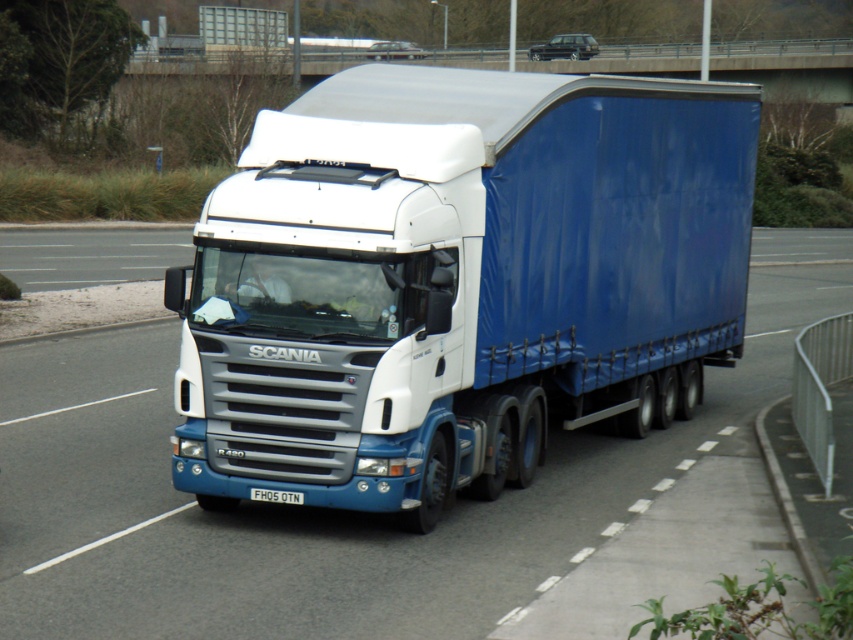
How much distance is there between white matte truck at center and blue fabric truck at center?

white matte truck at center is 3.17 meters away from blue fabric truck at center.

Does white matte truck at center appear over blue fabric truck at center?

No.

Is point (306, 156) more distant than point (125, 385)?

No, (306, 156) is closer to viewer.

The height and width of the screenshot is (640, 853). I want to click on white matte truck at center, so click(457, 280).

Between white matte truck at center and white plastic license plate at center, which one appears on the left side from the viewer's perspective?

Positioned to the left is white plastic license plate at center.

Between white matte truck at center and white plastic license plate at center, which one has more height?

white matte truck at center

Measure the distance between point (730, 168) and camera.

A distance of 18.87 meters exists between point (730, 168) and camera.

At what (x,y) coordinates should I click in order to perform the action: click on white matte truck at center. Please return your answer as a coordinate pair (x, y). The image size is (853, 640). Looking at the image, I should click on (457, 280).

Is blue fabric truck at center smaller than white plastic license plate at center?

No.

Who is lower down, blue fabric truck at center or white plastic license plate at center?

white plastic license plate at center

Where is `blue fabric truck at center`? This screenshot has width=853, height=640. blue fabric truck at center is located at coordinates [x=323, y=508].